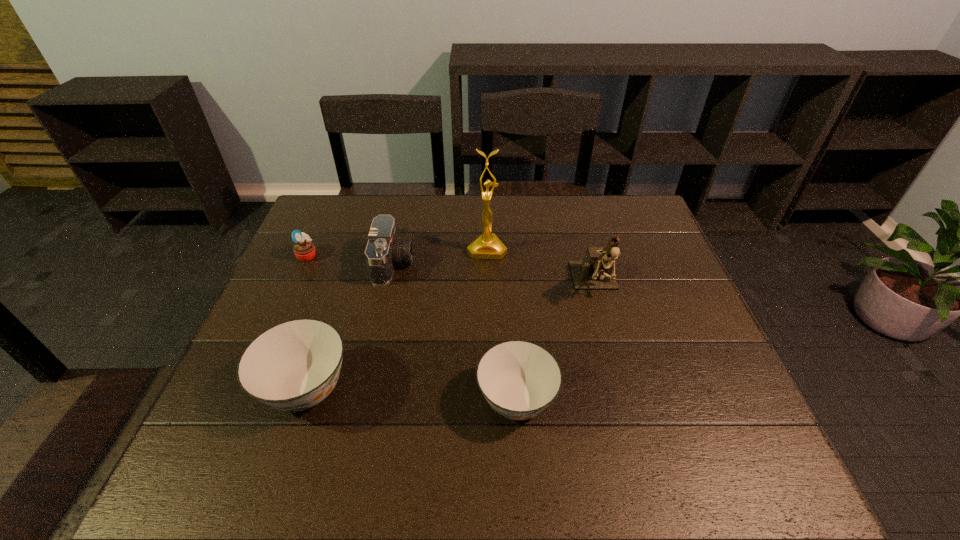
Identify the location of free space located 0.290m on the front-facing side of the camera. (513, 264).

This screenshot has height=540, width=960. I want to click on free space located on the front-facing side of the muffin, so [372, 255].

You are a GUI agent. You are given a task and a screenshot of the screen. Output one action in this format:
    pyautogui.click(x=<x>, y=<y>)
    Task: Click on the vacant area situated on the front-facing side of the rightmost object
    The height and width of the screenshot is (540, 960).
    Given the screenshot: What is the action you would take?
    pyautogui.click(x=629, y=406)

The height and width of the screenshot is (540, 960). In order to click on soup bowl that is at the left edge in this screenshot , I will do `click(294, 365)`.

The height and width of the screenshot is (540, 960). Identify the location of muffin at the left edge. (304, 250).

Where is `object at the near left corner`? This screenshot has height=540, width=960. object at the near left corner is located at coordinates (294, 365).

Locate an element on the screen. Image resolution: width=960 pixels, height=540 pixels. free region at the far edge of the desktop is located at coordinates (545, 206).

Where is `free space at the near edge of the desktop`? free space at the near edge of the desktop is located at coordinates (503, 418).

I want to click on vacant area at the left edge of the desktop, so click(x=290, y=316).

I want to click on free point at the right edge, so click(696, 358).